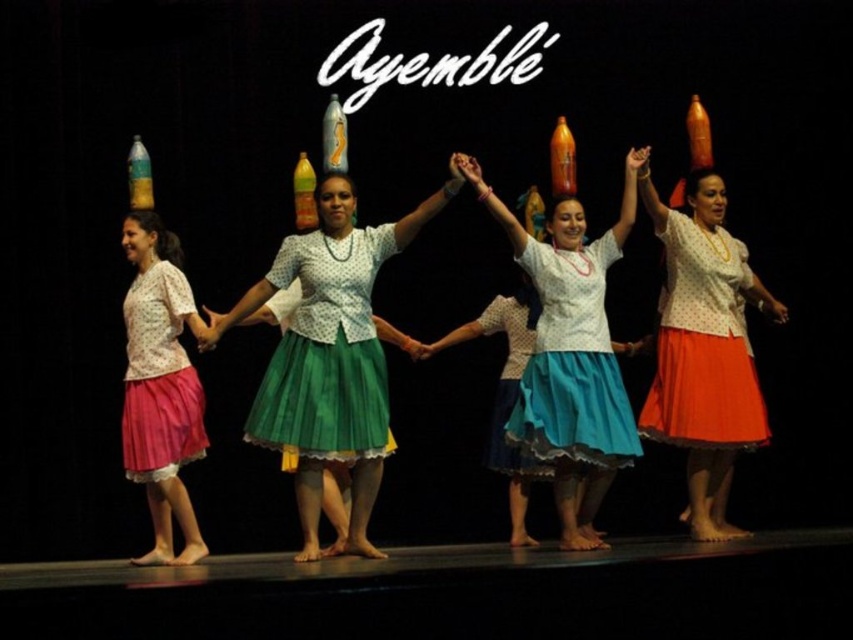
This screenshot has width=853, height=640. What do you see at coordinates (329, 355) in the screenshot? I see `polka dot fabric blouse at center` at bounding box center [329, 355].

This screenshot has height=640, width=853. What do you see at coordinates (329, 355) in the screenshot? I see `polka dot fabric blouse at center` at bounding box center [329, 355].

Where is `polka dot fabric blouse at center`? This screenshot has width=853, height=640. polka dot fabric blouse at center is located at coordinates (329, 355).

Between point (329, 252) and point (358, 429), which one is positioned in front?

Point (358, 429) is in front.

Describe the element at coordinates (329, 355) in the screenshot. I see `polka dot fabric blouse at center` at that location.

You are a GUI agent. You are given a task and a screenshot of the screen. Output one action in this format:
    pyautogui.click(x=<x>, y=<y>)
    Task: Click on the polka dot fabric blouse at center
    This screenshot has width=853, height=640.
    Given the screenshot: What is the action you would take?
    pyautogui.click(x=329, y=355)

Between point (155, 412) and point (515, 456), which one is positioned in front?

Point (155, 412) is in front.

Identify the location of pink chiffon skirt at left. The height and width of the screenshot is (640, 853). (160, 378).